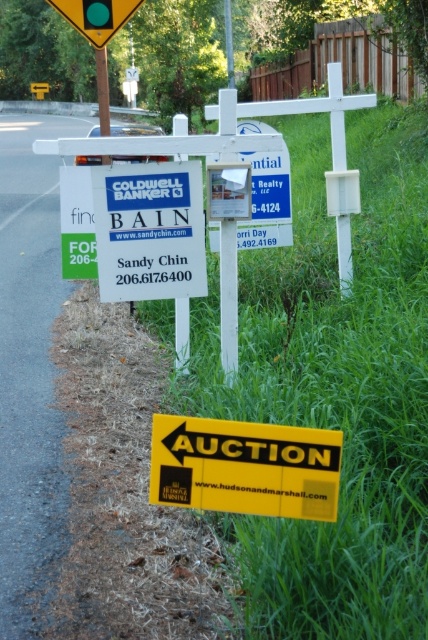
You are a pedestrian standing in front of the real estate sign. You see the green grass at lower right and the metallic yellow triangle at upper center. Which object is closer to you?

The green grass at lower right is closer to the viewer than the metallic yellow triangle at upper center.

What are the coordinates of the yellow matte auction sign at lower center in the image?

The yellow matte auction sign at lower center is located at coordinates (244, 467).